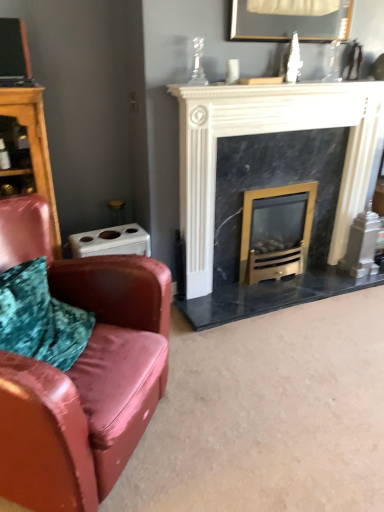
Locate an element on the screen. free spot to the right of leather couch at left is located at coordinates (235, 420).